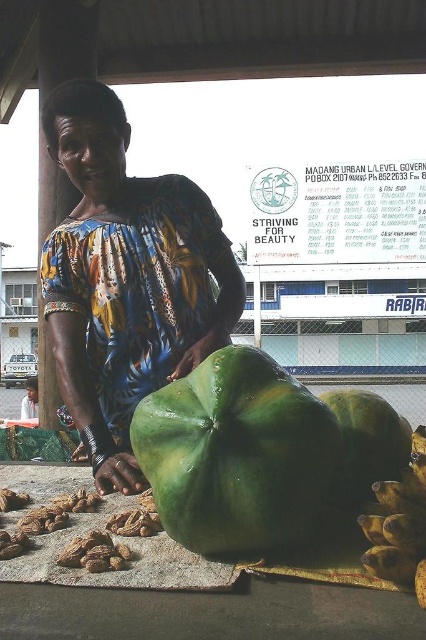
What is the relationship between the width of the printed fabric woman at center and the matte black shirt at center?

The printed fabric woman at center is wider than the matte black shirt at center.